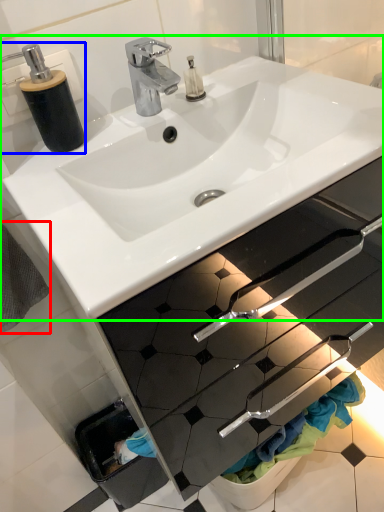
Question: Considering the real-world distances, which object is farthest from bath towel (highlighted by a red box)? soap dispenser (highlighted by a blue box) or sink (highlighted by a green box)?

Choices:
 (A) soap dispenser
 (B) sink

Answer: (B)